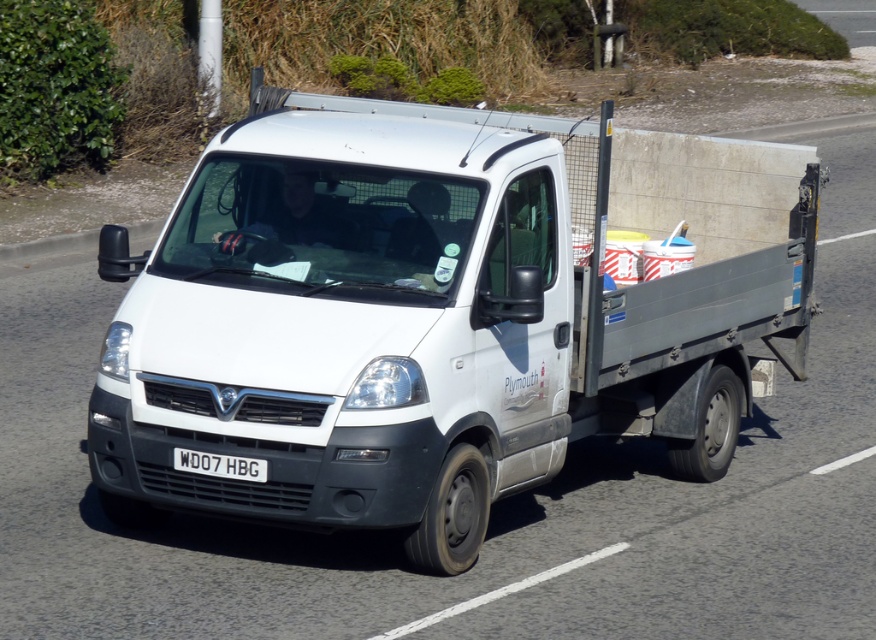
Question: Does white matte van at center appear on the right side of white plastic license plate at center?

Choices:
 (A) yes
 (B) no

Answer: (A)

Question: Is white matte van at center above white plastic license plate at center?

Choices:
 (A) yes
 (B) no

Answer: (A)

Question: Among these points, which one is farthest from the camera?

Choices:
 (A) (328, 124)
 (B) (237, 470)

Answer: (A)

Question: Which object is farther from the camera taking this photo?

Choices:
 (A) white matte van at center
 (B) white plastic license plate at center

Answer: (B)

Question: Can you confirm if white matte van at center is positioned below white plastic license plate at center?

Choices:
 (A) no
 (B) yes

Answer: (A)

Question: Among these objects, which one is nearest to the camera?

Choices:
 (A) white matte van at center
 (B) white plastic license plate at center

Answer: (A)